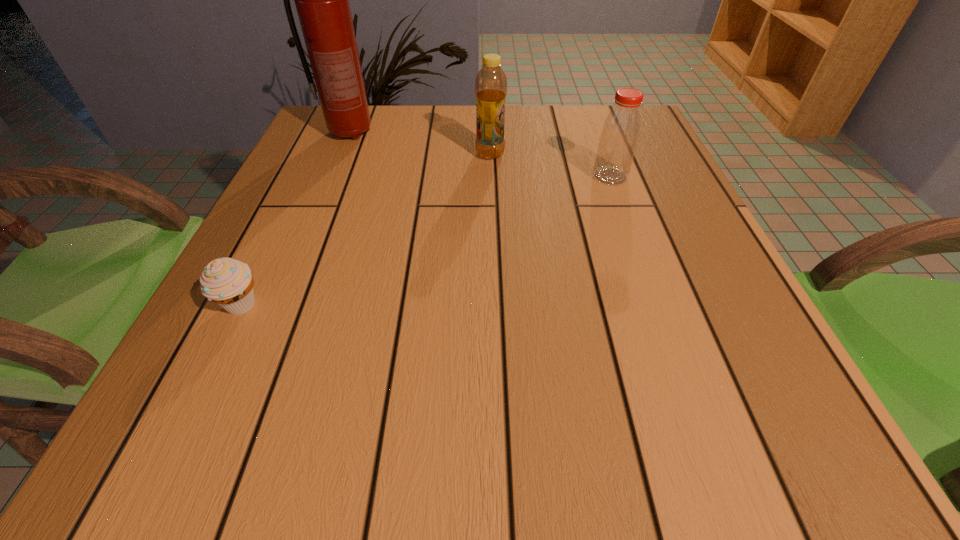
The height and width of the screenshot is (540, 960). Find the location of `free region at the left edge of the desktop`. free region at the left edge of the desktop is located at coordinates (247, 258).

The height and width of the screenshot is (540, 960). Identify the location of vacant space at the right edge of the desktop. (641, 279).

In the image, there is a desktop. Identify the location of free space at the far left corner. The image size is (960, 540). (382, 105).

Find the location of a particular element. vacant area at the near right corner of the desktop is located at coordinates (817, 463).

The height and width of the screenshot is (540, 960). I want to click on free point between the third shortest object and the shorter bottle, so tap(550, 165).

Where is `vacant region between the farthest object and the second farthest object`? vacant region between the farthest object and the second farthest object is located at coordinates (420, 144).

Image resolution: width=960 pixels, height=540 pixels. Identify the location of vacant point located between the muffin and the second shortest object. (425, 241).

Locate an element on the screen. The image size is (960, 540). empty space between the second nearest object and the nearest object is located at coordinates (425, 241).

Identify the location of vacant area between the nearer bottle and the taller bottle. Image resolution: width=960 pixels, height=540 pixels. (550, 165).

Where is `empty space between the shortest object and the tallest object`? This screenshot has height=540, width=960. empty space between the shortest object and the tallest object is located at coordinates (295, 219).